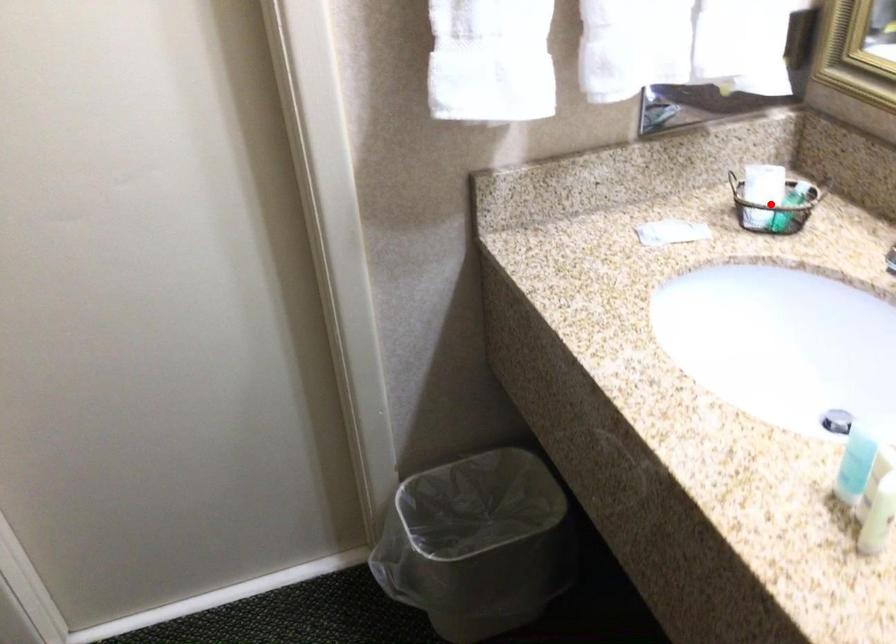
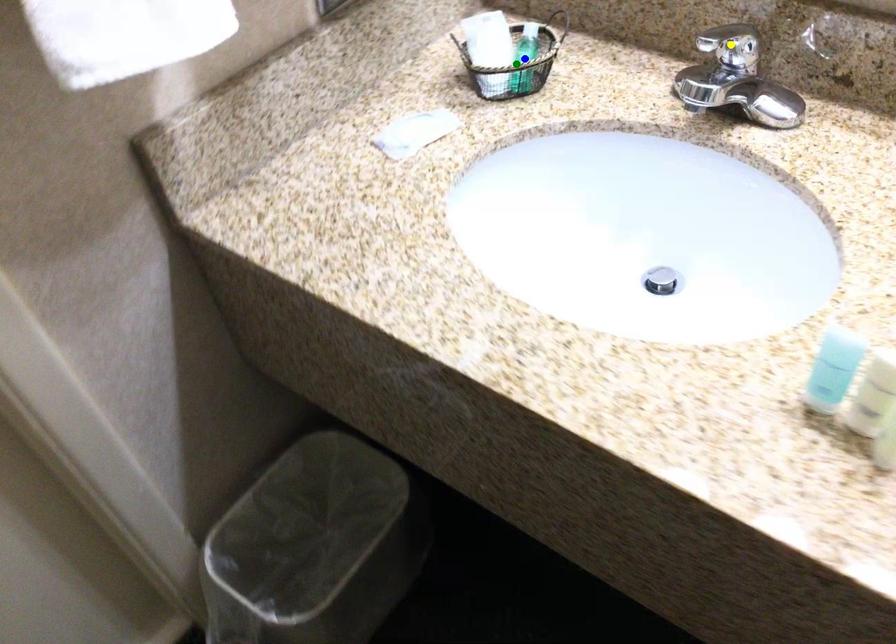
Question: I am providing you with two images of the same scene from different viewpoints. A red point is marked on the first image. You are given multiple points on the second image. Which point in image 2 represents the same 3d spot as the red point in image 1?

Choices:
 (A) blue point
 (B) green point
 (C) yellow point

Answer: (B)